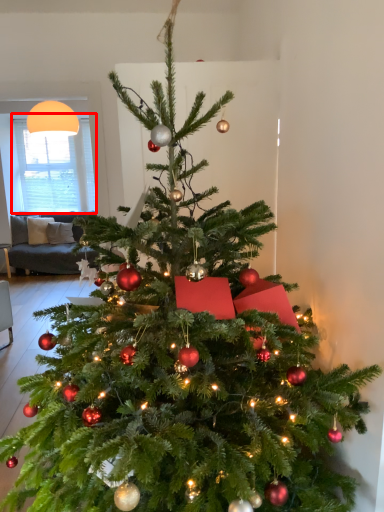
Question: Where is window screen (annotated by the red box) located in relation to lamp in the image?

Choices:
 (A) left
 (B) right

Answer: (A)